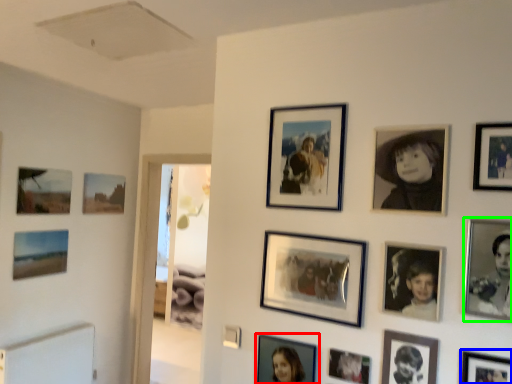
Question: Considering the real-world distances, which object is closest to picture frame (highlighted by a red box)? picture frame (highlighted by a blue box) or picture frame (highlighted by a green box).

Choices:
 (A) picture frame
 (B) picture frame

Answer: (A)